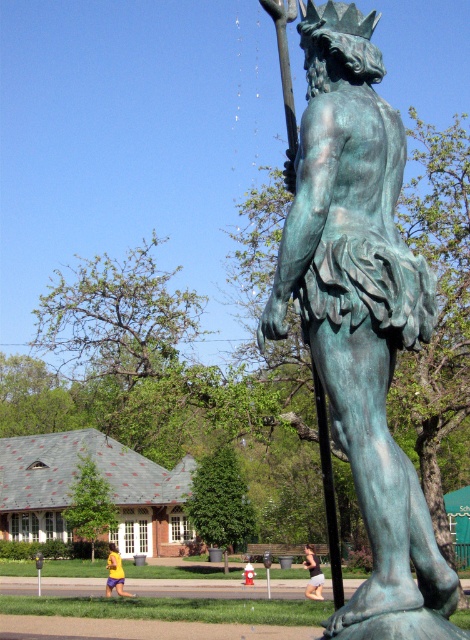
Can you confirm if black metal pole at center is shorter than black fabric shorts at lower center?

Yes, black metal pole at center is shorter than black fabric shorts at lower center.

Does black metal pole at center have a smaller size compared to black fabric shorts at lower center?

Yes.

The height and width of the screenshot is (640, 470). I want to click on black metal pole at center, so click(x=328, y=490).

This screenshot has width=470, height=640. Identify the location of black metal pole at center. (328, 490).

Is point (319, 584) closer to viewer compared to point (109, 564)?

Yes, it is in front of point (109, 564).

Does black fabric shorts at lower center have a lesser width compared to yellow fabric at lower left?

Yes, black fabric shorts at lower center is thinner than yellow fabric at lower left.

The image size is (470, 640). I want to click on black fabric shorts at lower center, so click(x=313, y=573).

This screenshot has height=640, width=470. I want to click on black fabric shorts at lower center, so click(x=313, y=573).

Can you confirm if green patina statue at center is thinner than yellow fabric at lower left?

Correct, green patina statue at center's width is less than yellow fabric at lower left's.

Who is more forward, (353,435) or (114,564)?

Positioned in front is point (353,435).

What do you see at coordinates (361, 316) in the screenshot? The width and height of the screenshot is (470, 640). I see `green patina statue at center` at bounding box center [361, 316].

This screenshot has height=640, width=470. I want to click on green patina statue at center, so click(x=361, y=316).